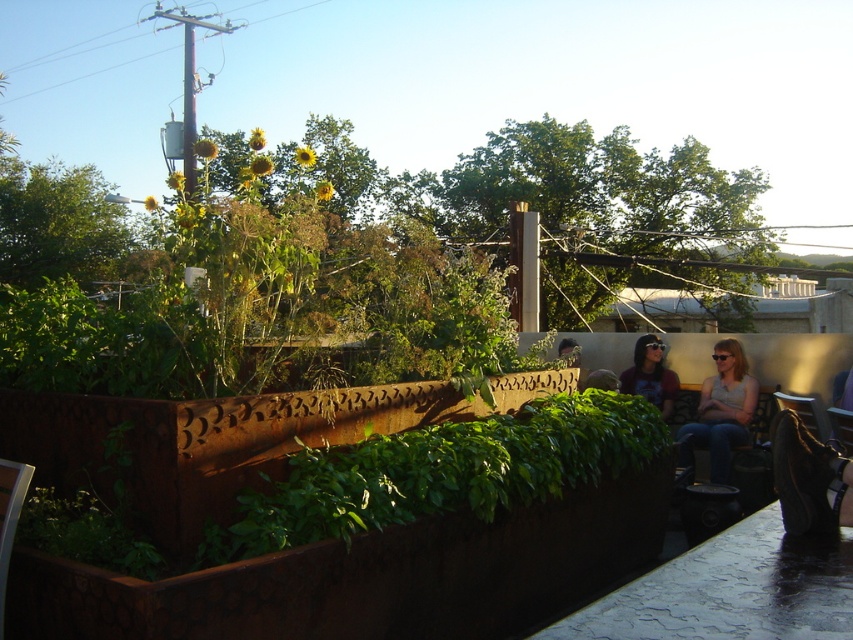
You are a photographer setting up a tripod to capture the denim jeans at right and the matte brown shirt at center. If the tripod has a width of 1.2 meters, will it fit between the two objects without overlapping them?

The denim jeans at right might be wider than the matte brown shirt at center, so the tripod with a width of 1.2 meters may not fit between them if the space between the objects is narrower than 1.2 meters. However, since the exact width difference isn not specified, it is uncertain.

You are a photographer trying to capture a candid shot of the denim jeans at right and the matte brown shirt at center. Since you want both subjects to be clearly visible, which one should you focus on first to ensure proper focus, considering their sizes?

The denim jeans at right is larger in size than the matte brown shirt at center, so you should focus on the denim jeans at right first to ensure proper focus as it takes up more space in the frame.